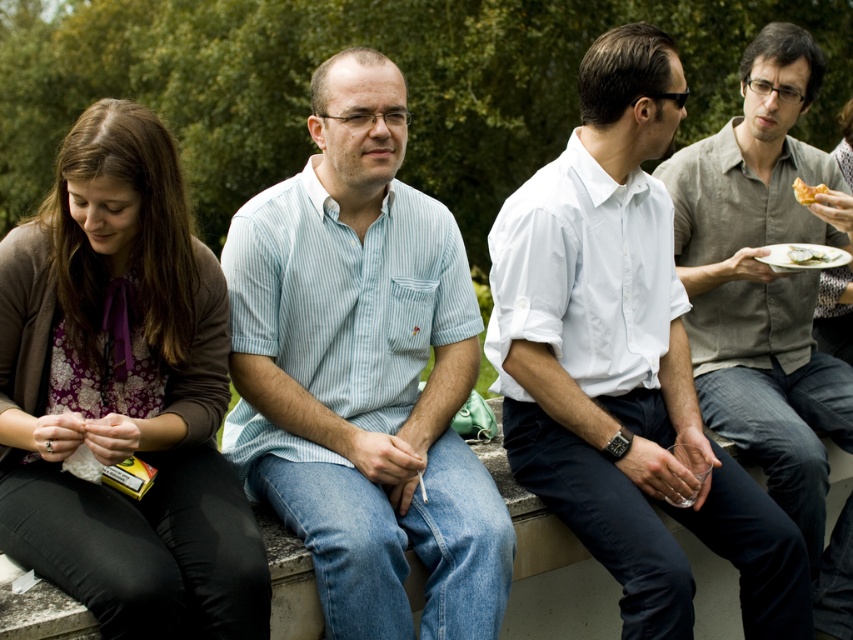
The image size is (853, 640). Describe the element at coordinates (804, 257) in the screenshot. I see `white ceramic plate at upper right` at that location.

Measure the distance from white ceramic plate at upper right to white creamy cake at right.

The distance of white ceramic plate at upper right from white creamy cake at right is 0.60 inches.

Does point (842, 257) come closer to viewer compared to point (834, 253)?

Yes, point (842, 257) is in front of point (834, 253).

You are a GUI agent. You are given a task and a screenshot of the screen. Output one action in this format:
    pyautogui.click(x=<x>, y=<y>)
    Task: Click on the white ceramic plate at upper right
    
    Given the screenshot: What is the action you would take?
    pyautogui.click(x=804, y=257)

Is white creamy cake at right thinner than golden crispy pastry at upper right?

Incorrect, white creamy cake at right's width is not less than golden crispy pastry at upper right's.

Which is in front, point (804, 253) or point (804, 184)?

Point (804, 184) is more forward.

This screenshot has height=640, width=853. What are the coordinates of `white creamy cake at right` in the screenshot? It's located at (811, 256).

Who is shorter, matte brown sweater at left or golden crispy pastry at upper right?

golden crispy pastry at upper right

You are a GUI agent. You are given a task and a screenshot of the screen. Output one action in this format:
    pyautogui.click(x=<x>, y=<y>)
    Task: Click on the matte brown sweater at left
    Image resolution: width=853 pixels, height=640 pixels.
    Given the screenshot: What is the action you would take?
    (x=123, y=394)

This screenshot has width=853, height=640. I want to click on matte brown sweater at left, so click(123, 394).